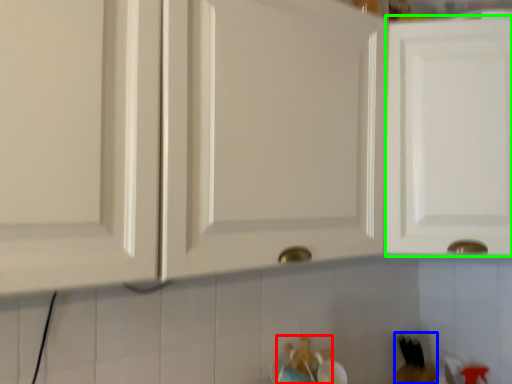
Question: Based on their relative distances, which object is nearer to toy (highlighted by a red box)? Choose from toy (highlighted by a blue box) and cabinetry (highlighted by a green box).

Choices:
 (A) toy
 (B) cabinetry

Answer: (A)